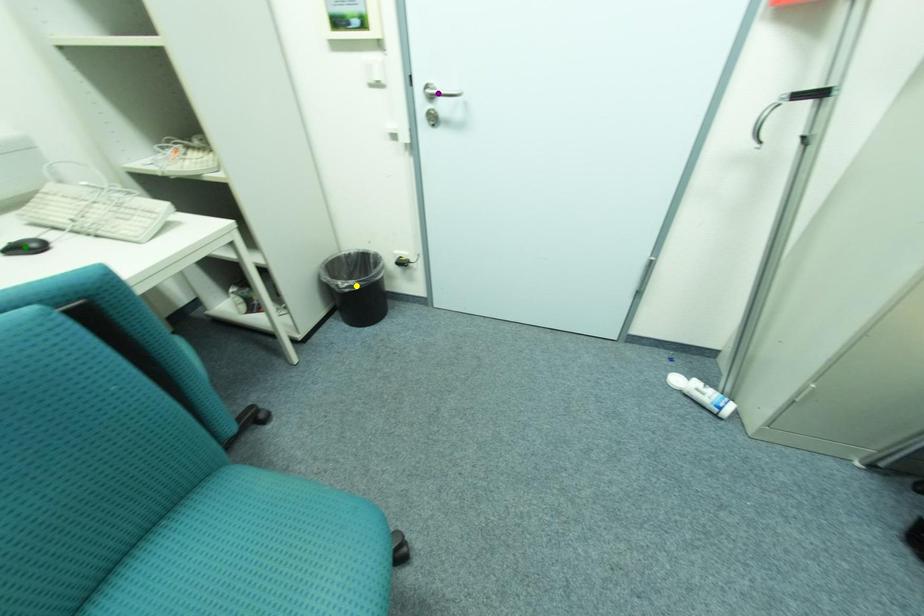
Order these from nearest to farthest:
1. yellow point
2. green point
3. purple point

green point < purple point < yellow point